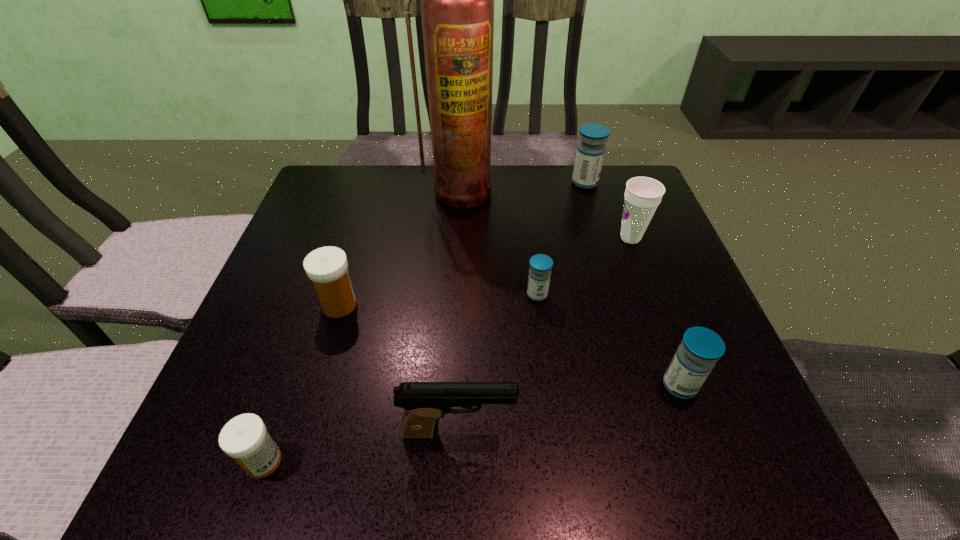
This screenshot has height=540, width=960. In order to click on red fire extinguisher in this screenshot , I will do `click(457, 0)`.

Identify the location of fire extinguisher. The width and height of the screenshot is (960, 540). coord(457,0).

The width and height of the screenshot is (960, 540). I want to click on the biggest blue medicine, so click(590, 153).

Identify the location of the tallest medicine. (590, 153).

The width and height of the screenshot is (960, 540). In order to click on purple cup in this screenshot , I will do `click(642, 195)`.

Where is `cup`? cup is located at coordinates coord(642,195).

Locate an element on the screen. pistol is located at coordinates 424,403.

Locate an element on the screen. This screenshot has height=540, width=960. the seventh farthest object is located at coordinates (424, 403).

Where is `the farther white medicine`? the farther white medicine is located at coordinates (327, 267).

You are a GUI agent. You are given a task and a screenshot of the screen. Output one action in this format:
    pyautogui.click(x=<x>, y=<y>)
    Task: Click on the third nearest object
    
    Given the screenshot: What is the action you would take?
    tap(700, 349)